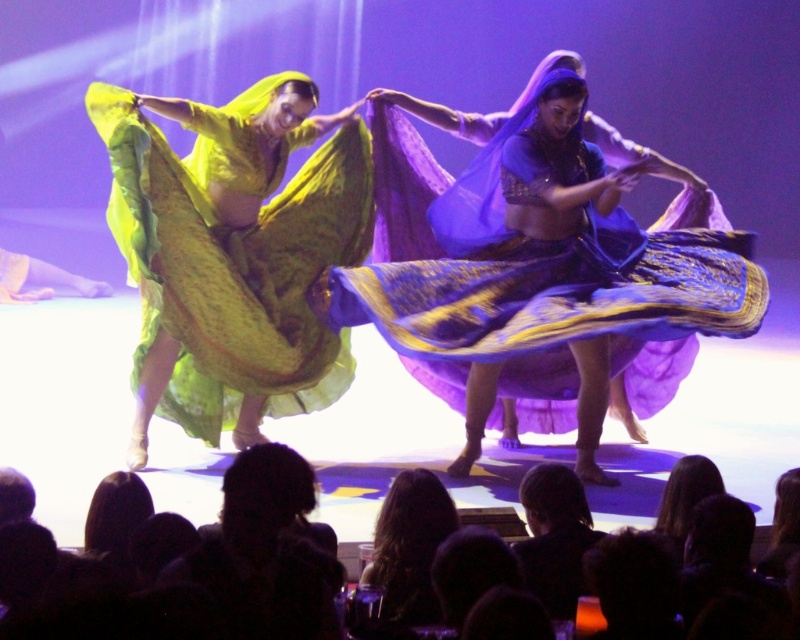
You are a stagehand preparing to adjust the lighting for the performers. You notice the matte purple fabric at center and the dark fabric headscarf at lower center. Which object requires a spotlight with a higher vertical reach to properly illuminate its height?

The matte purple fabric at center requires a spotlight with a higher vertical reach because it is much taller than the dark fabric headscarf at lower center.

You are a stagehand setting up for a performance. You need to adjust the lighting so that the matte purple fabric at center and the matte green fabric at left are both visible. Which fabric should you focus the spotlight on first to ensure it is properly lit?

The matte purple fabric at center is in front of the matte green fabric at left, so you should focus the spotlight on the matte purple fabric at center first to ensure it is properly lit before adjusting for the one behind.